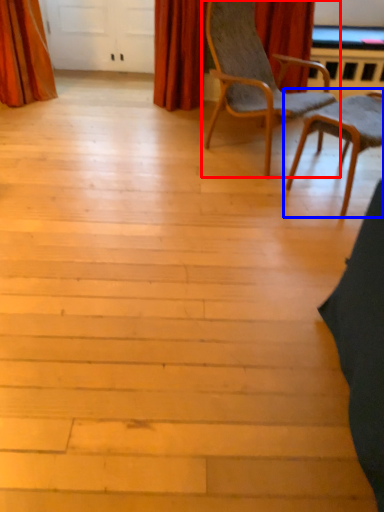
Question: Which point is closer to the camera, chair (highlighted by a red box) or chair (highlighted by a blue box)?

Choices:
 (A) chair
 (B) chair

Answer: (A)